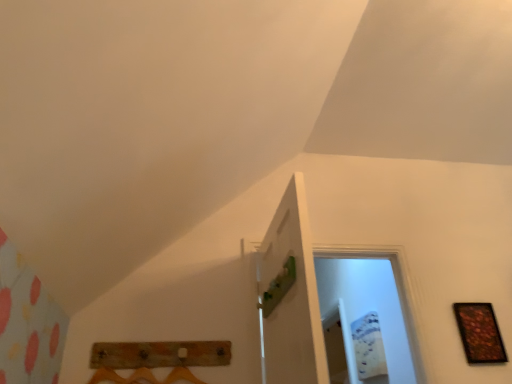
Question: Is green matte door at center far away from rustic wood coat rack at lower center?

Choices:
 (A) yes
 (B) no

Answer: (B)

Question: Is green matte door at center behind rustic wood coat rack at lower center?

Choices:
 (A) yes
 (B) no

Answer: (B)

Question: From a real-world perspective, is green matte door at center on rustic wood coat rack at lower center?

Choices:
 (A) no
 (B) yes

Answer: (B)

Question: Is green matte door at center completely or partially outside of rustic wood coat rack at lower center?

Choices:
 (A) no
 (B) yes

Answer: (B)

Question: Is rustic wood coat rack at lower center located within green matte door at center?

Choices:
 (A) yes
 (B) no

Answer: (B)

Question: Is green matte door at center thinner than rustic wood coat rack at lower center?

Choices:
 (A) yes
 (B) no

Answer: (B)

Question: From the image's perspective, would you say wooden picture frame at right is shown under rustic wood coat rack at lower center?

Choices:
 (A) yes
 (B) no

Answer: (A)

Question: Considering the relative sizes of wooden picture frame at right and rustic wood coat rack at lower center in the image provided, is wooden picture frame at right thinner than rustic wood coat rack at lower center?

Choices:
 (A) no
 (B) yes

Answer: (B)

Question: Can you confirm if wooden picture frame at right is wider than rustic wood coat rack at lower center?

Choices:
 (A) yes
 (B) no

Answer: (B)

Question: Is wooden picture frame at right at the left side of rustic wood coat rack at lower center?

Choices:
 (A) yes
 (B) no

Answer: (B)

Question: Is wooden picture frame at right positioned beyond the bounds of rustic wood coat rack at lower center?

Choices:
 (A) no
 (B) yes

Answer: (B)

Question: Does wooden picture frame at right appear on the right side of rustic wood coat rack at lower center?

Choices:
 (A) yes
 (B) no

Answer: (A)

Question: Does green matte door at center have a smaller size compared to wooden picture frame at right?

Choices:
 (A) yes
 (B) no

Answer: (B)